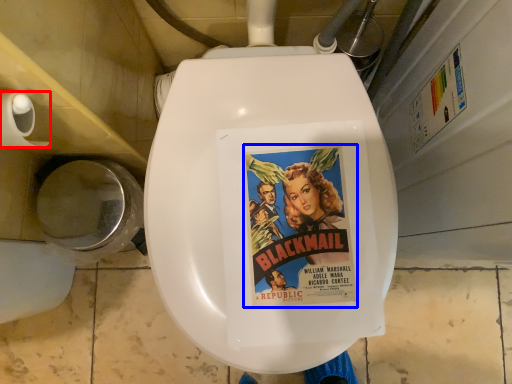
Question: Which object appears farthest to the camera in this image, toilet paper (highlighted by a red box) or movie poster (highlighted by a blue box)?

Choices:
 (A) toilet paper
 (B) movie poster

Answer: (B)